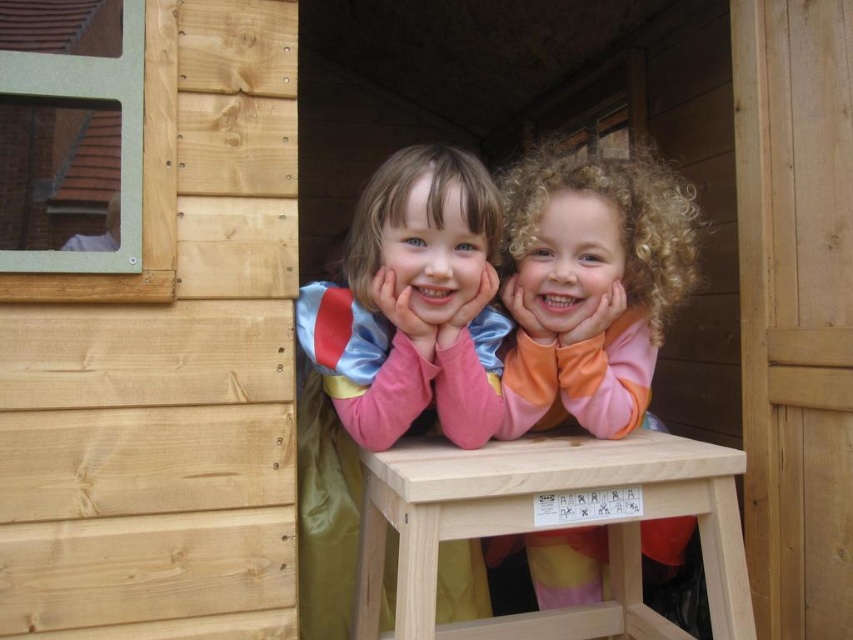
You are a photographer trying to capture a clear shot of the matte pink sweater at center and the light wood stool at center inside the playhouse. Since the playhouse interior is dark, you need to adjust your camera settings. However, you notice an issue with depth of field. Which object is closer to the camera lens so that it remains in focus while the other might blur?

The matte pink sweater at center is closer to the camera lens than the light wood stool at center, so it will stay in focus while the stool may appear blurred.